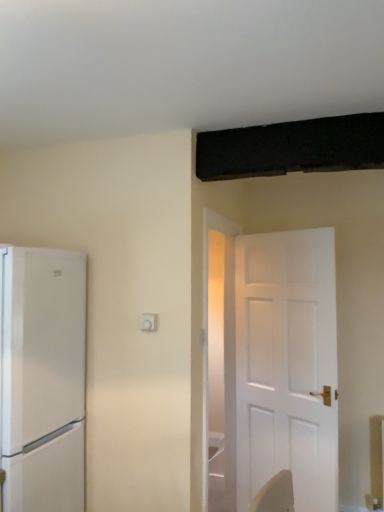
What is the approximate height of white matte refrigerator at left?

It is 4.85 feet.

What is the approximate width of white matte refrigerator at left?

white matte refrigerator at left is 25.49 inches in width.

Measure the distance between point (5, 270) and camera.

The depth of point (5, 270) is 1.78 meters.

This screenshot has width=384, height=512. Describe the element at coordinates (43, 379) in the screenshot. I see `white matte refrigerator at left` at that location.

In order to click on white matte refrigerator at left in this screenshot , I will do `click(43, 379)`.

Locate an element on the screen. This screenshot has width=384, height=512. white matte refrigerator at left is located at coordinates (43, 379).